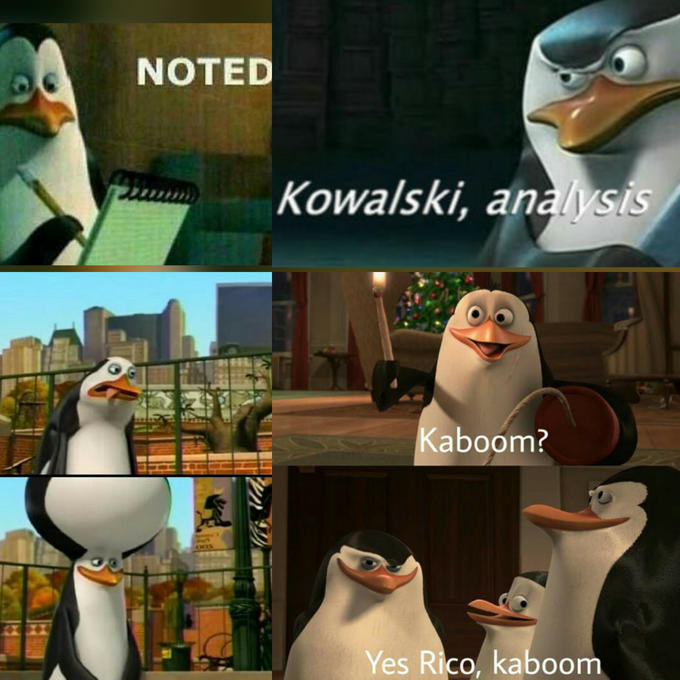
Locate an element on the screen. Image resolution: width=680 pixels, height=680 pixels. carpet is located at coordinates (338, 424).